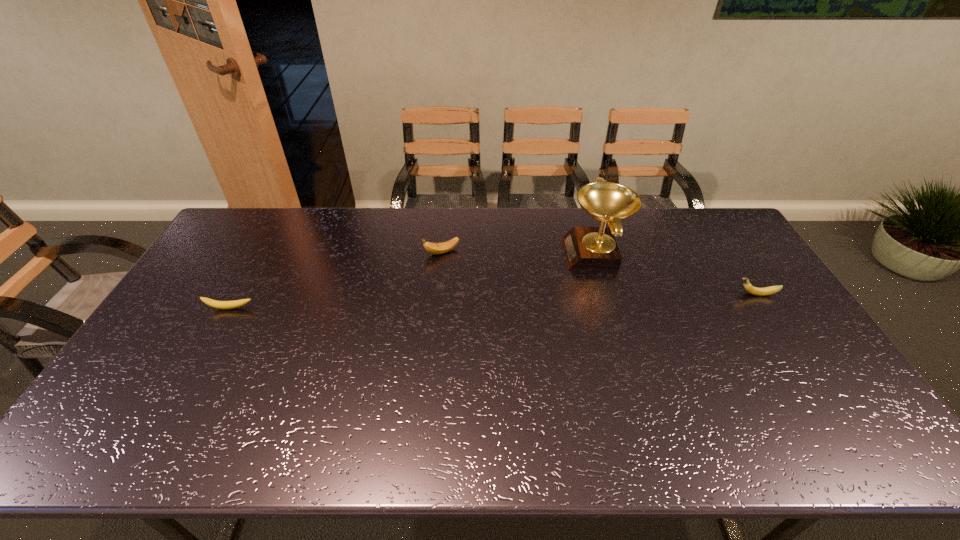
Find the location of a particular element. The image size is (960, 540). vacant space that satisfies the following two spatial constraints: 1. at the stem of the rightmost banana; 2. on the upward curve of the leftmost banana is located at coordinates (765, 308).